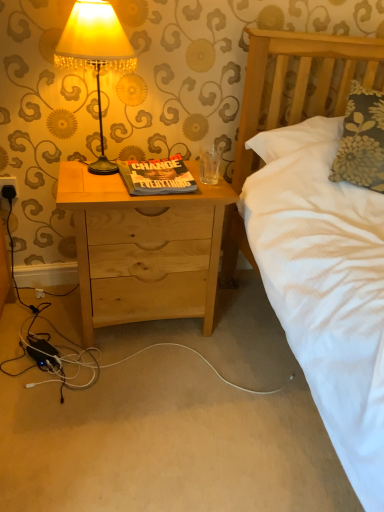
Question: Should I look upward or downward to see matte yellow fabric lampshade at upper left?

Choices:
 (A) down
 (B) up

Answer: (B)

Question: Can you confirm if natural wood nightstand at center is taller than matte yellow fabric lampshade at upper left?

Choices:
 (A) yes
 (B) no

Answer: (A)

Question: Would you say natural wood nightstand at center is outside matte yellow fabric lampshade at upper left?

Choices:
 (A) yes
 (B) no

Answer: (A)

Question: Does natural wood nightstand at center have a greater width compared to matte yellow fabric lampshade at upper left?

Choices:
 (A) no
 (B) yes

Answer: (B)

Question: Does natural wood nightstand at center turn towards matte yellow fabric lampshade at upper left?

Choices:
 (A) yes
 (B) no

Answer: (B)

Question: Can you confirm if natural wood nightstand at center is bigger than matte yellow fabric lampshade at upper left?

Choices:
 (A) no
 (B) yes

Answer: (B)

Question: From a real-world perspective, is natural wood nightstand at center over matte yellow fabric lampshade at upper left?

Choices:
 (A) yes
 (B) no

Answer: (B)

Question: Is matte yellow fabric lampshade at upper left inside black plastic electric outlet at lower left?

Choices:
 (A) no
 (B) yes

Answer: (A)

Question: Can you confirm if black plastic electric outlet at lower left is thinner than matte yellow fabric lampshade at upper left?

Choices:
 (A) no
 (B) yes

Answer: (B)

Question: Does black plastic electric outlet at lower left come in front of matte yellow fabric lampshade at upper left?

Choices:
 (A) no
 (B) yes

Answer: (A)

Question: Is black plastic electric outlet at lower left further to the viewer compared to matte yellow fabric lampshade at upper left?

Choices:
 (A) yes
 (B) no

Answer: (A)

Question: Is black plastic electric outlet at lower left shorter than matte yellow fabric lampshade at upper left?

Choices:
 (A) yes
 (B) no

Answer: (A)

Question: Can you confirm if black plastic electric outlet at lower left is taller than matte yellow fabric lampshade at upper left?

Choices:
 (A) no
 (B) yes

Answer: (A)

Question: Can black plastic electric outlet at lower left be found inside matte yellow fabric lampshade at upper left?

Choices:
 (A) no
 (B) yes

Answer: (A)